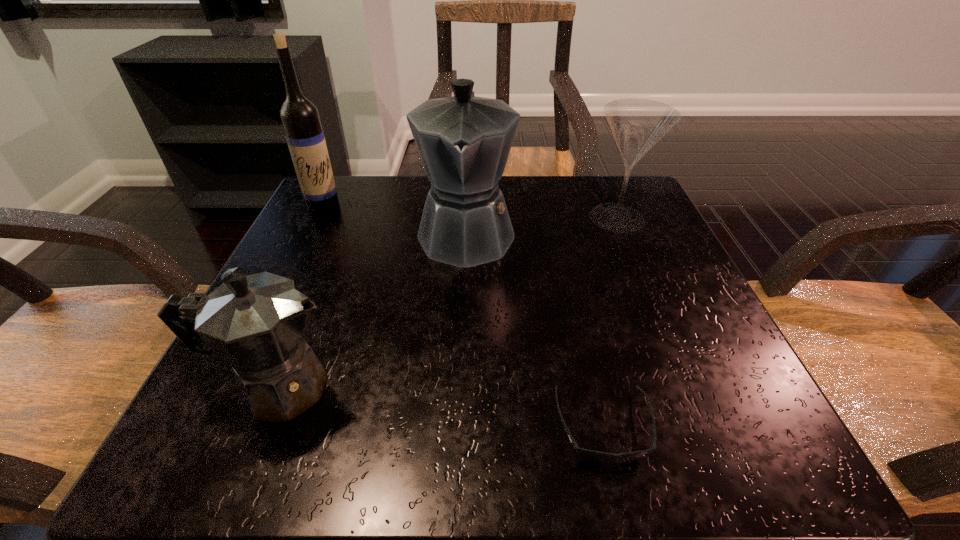
You are a GUI agent. You are given a task and a screenshot of the screen. Output one action in this format:
    pyautogui.click(x=<x>, y=<y>)
    Task: Click on the vacant space at the far right corner of the desktop
    The width and height of the screenshot is (960, 540).
    Given the screenshot: What is the action you would take?
    pyautogui.click(x=645, y=202)

The image size is (960, 540). In the image, there is a desktop. Find the location of `vacant space at the near right corner`. vacant space at the near right corner is located at coordinates (646, 408).

Locate an element on the screen. The image size is (960, 540). free space between the flute glass and the right coffeepot is located at coordinates (541, 225).

The width and height of the screenshot is (960, 540). Identify the location of vacant area that lies between the nearer coffeepot and the rightmost object. (446, 302).

At what (x,y) coordinates should I click in order to perform the action: click on free spot between the fourth object from left to right and the left coffeepot. Please return your answer as a coordinate pair (x, y). The width and height of the screenshot is (960, 540). Looking at the image, I should click on (440, 407).

Where is `vacant point located between the sunglasses and the shorter coffeepot`? The image size is (960, 540). vacant point located between the sunglasses and the shorter coffeepot is located at coordinates (440, 407).

I want to click on blank region between the taller coffeepot and the flute glass, so click(541, 225).

Find the location of a particular element. blank region between the right coffeepot and the wine bottle is located at coordinates (396, 220).

Where is `blank region between the fourth object from left to right and the flute glass`? The height and width of the screenshot is (540, 960). blank region between the fourth object from left to right and the flute glass is located at coordinates (611, 322).

The width and height of the screenshot is (960, 540). I want to click on vacant area that lies between the right coffeepot and the shortest object, so click(x=535, y=329).